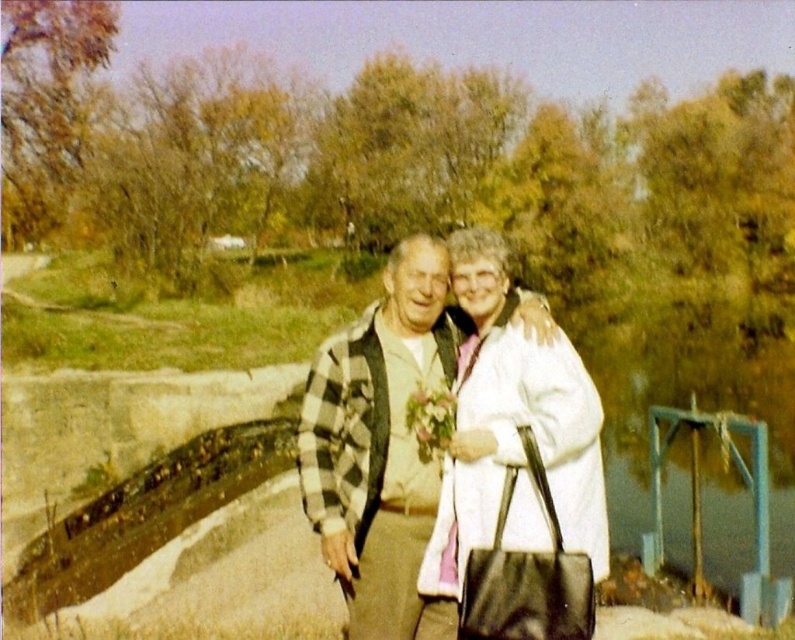
You are a photographer standing at the camera position. You want to take a photo where both the point at point (318, 486) and the point at point (443, 396) are in focus. Which point should you focus on to ensure both are sharp?

You should focus on point (318, 486) because it is closer to the camera, and focusing on the closer object will keep both in focus due to the depth of field extending further behind it.

You are a photographer trying to capture the perfect shot of the matte black jacket at center and the pastel floral bouquet at center. From the perspective of the photographer, which object is positioned to the right side?

The matte black jacket at center is positioned to the right of the pastel floral bouquet at center.

What object is located at the coordinates point (415, 440) in the scene?

The point (415, 440) corresponds to the matte black jacket at center.